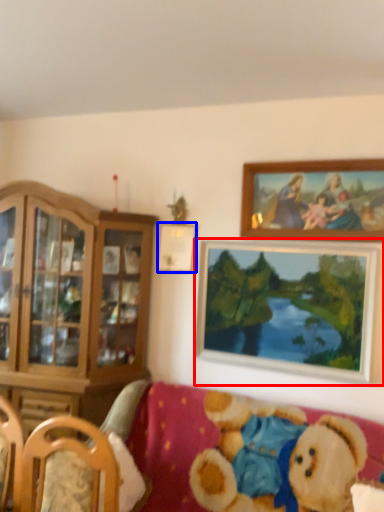
Question: Which object is further to the camera taking this photo, picture frame (highlighted by a red box) or picture frame (highlighted by a blue box)?

Choices:
 (A) picture frame
 (B) picture frame

Answer: (B)